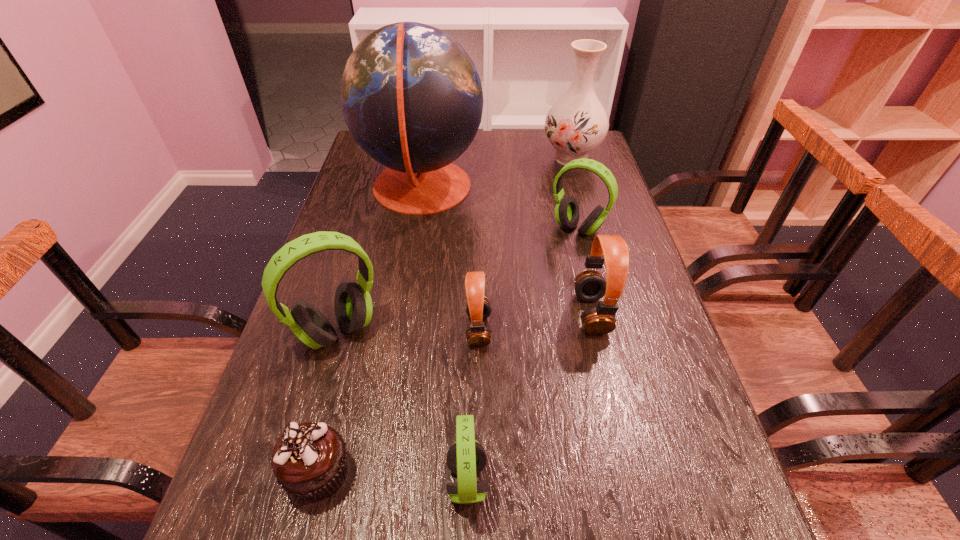
Identify the location of free space that satisfies the following two spatial constraints: 1. with the Americas facing the viewer on the globe; 2. on the back side of the farthest headset. (415, 228).

Where is `vacant region that satisfies the following two spatial constraints: 1. on the front side of the leftmost green headset; 2. on the left side of the shortest object`? The width and height of the screenshot is (960, 540). vacant region that satisfies the following two spatial constraints: 1. on the front side of the leftmost green headset; 2. on the left side of the shortest object is located at coordinates [298, 472].